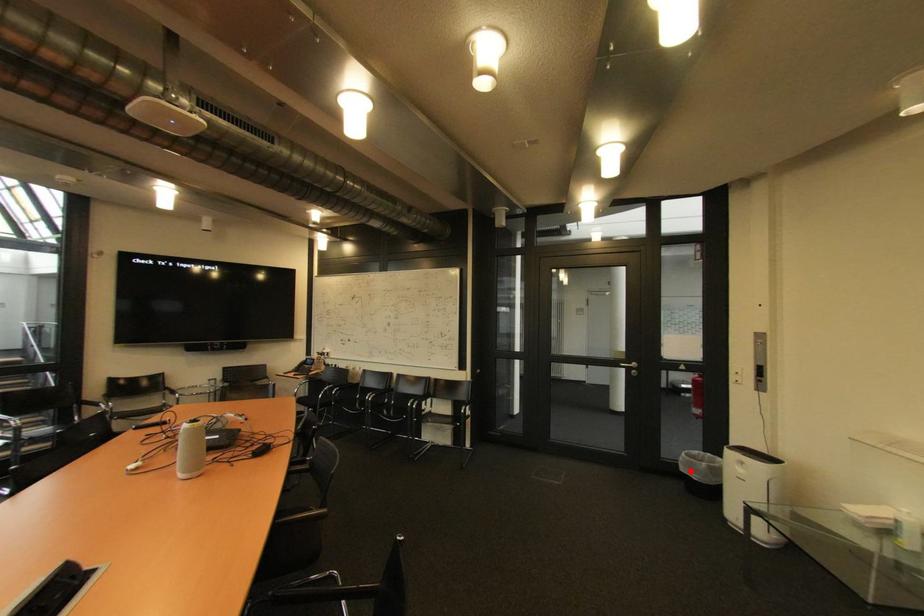
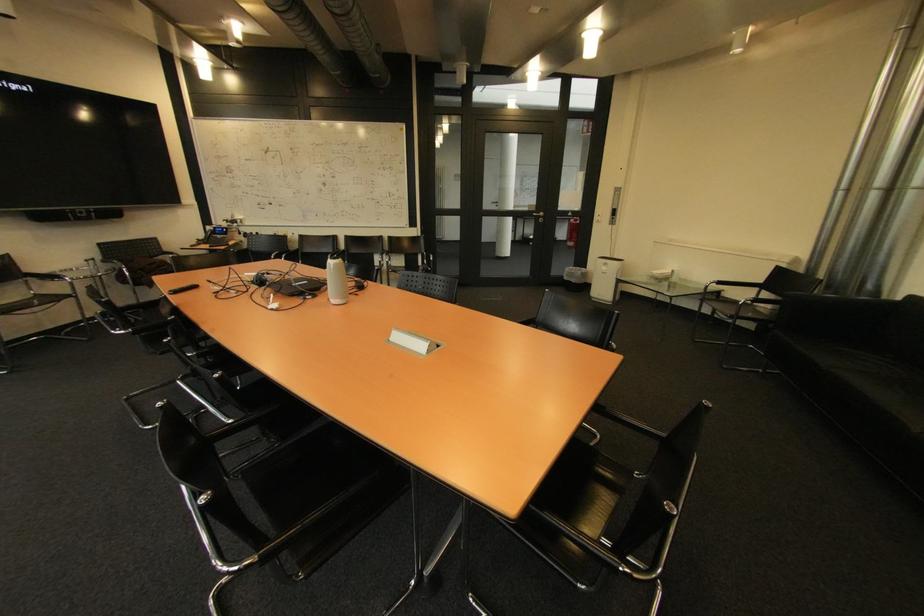
Question: I am providing you with two images of the same scene from different viewpoints. Image1 has a red point marked. In image2, the corresponding 3D location appears at what relative position? Reply with the corresponding letter.

Choices:
 (A) Closer
 (B) Farther

Answer: (A)